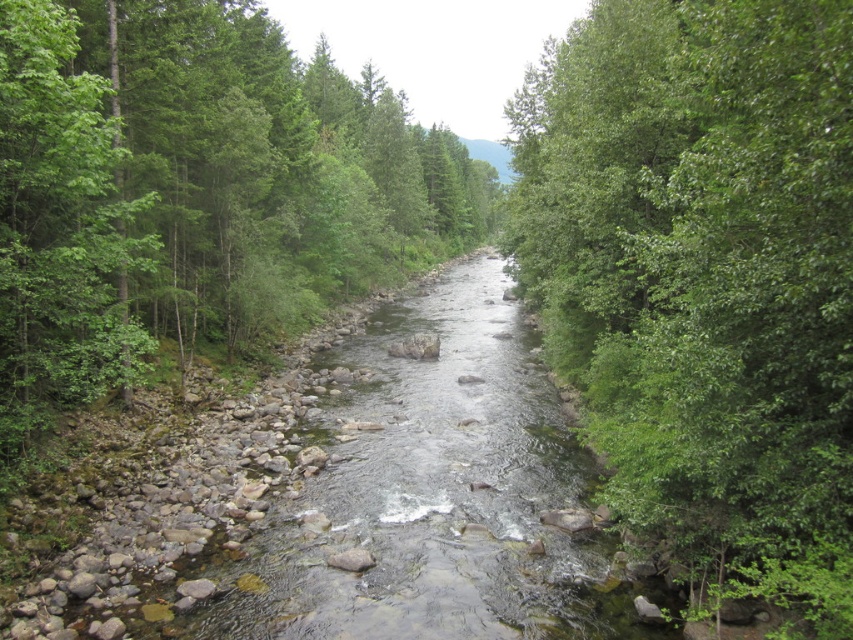
You are planning to plant a new tree in this area. The new tree requires a minimum of 100 feet of space between it and any existing trees to thrive. Given the current spacing between the green leafy tree at right and the green leafy tree at center, is this spacing sufficient for the new tree?

The green leafy tree at right and the green leafy tree at center are 146.31 feet apart from each other. Since the required minimum spacing for the new tree is 100 feet, the existing trees already meet this requirement. Therefore, the spacing between them is sufficient for the new tree to thrive.